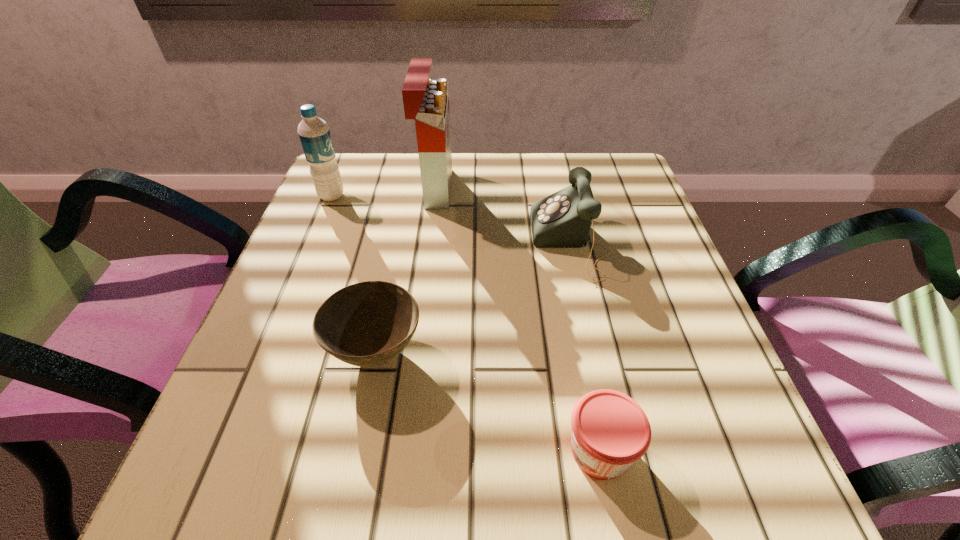
This screenshot has height=540, width=960. I want to click on vacant space situated 0.260m on the dial of the telephone, so tap(406, 243).

The image size is (960, 540). In order to click on vacant space located 0.080m on the back of the fourth farthest object in this screenshot , I will do `click(390, 284)`.

You are a GUI agent. You are given a task and a screenshot of the screen. Output one action in this format:
    pyautogui.click(x=<x>, y=<y>)
    Task: Click on the free location located on the front label of the jam
    
    Given the screenshot: What is the action you would take?
    pyautogui.click(x=505, y=450)

At what (x,y) coordinates should I click in order to perform the action: click on vacant space located 0.230m on the front label of the jam. Please return your answer as a coordinate pair (x, y). This screenshot has width=960, height=540. Looking at the image, I should click on (395, 450).

Locate an element on the screen. The height and width of the screenshot is (540, 960). vacant space located on the front label of the jam is located at coordinates (388, 450).

The width and height of the screenshot is (960, 540). Identify the location of cigarette case that is at the far edge. (426, 100).

You are a GUI agent. You are given a task and a screenshot of the screen. Output one action in this format:
    pyautogui.click(x=<x>, y=<y>)
    Task: Click on the water bottle located in the far edge section of the desktop
    The image size is (960, 540).
    Given the screenshot: What is the action you would take?
    pyautogui.click(x=314, y=133)

Locate an element on the screen. The width and height of the screenshot is (960, 540). object that is positioned at the near edge is located at coordinates (610, 431).

You are a GUI agent. You are given a task and a screenshot of the screen. Output one action in this format:
    pyautogui.click(x=<x>, y=<y>)
    Task: Click on the water bottle that is at the left edge
    Image resolution: width=960 pixels, height=540 pixels.
    Given the screenshot: What is the action you would take?
    pyautogui.click(x=314, y=133)

At what (x,y) coordinates should I click in order to perform the action: click on bowl present at the left edge. Please return your answer as a coordinate pair (x, y). Looking at the image, I should click on (367, 324).